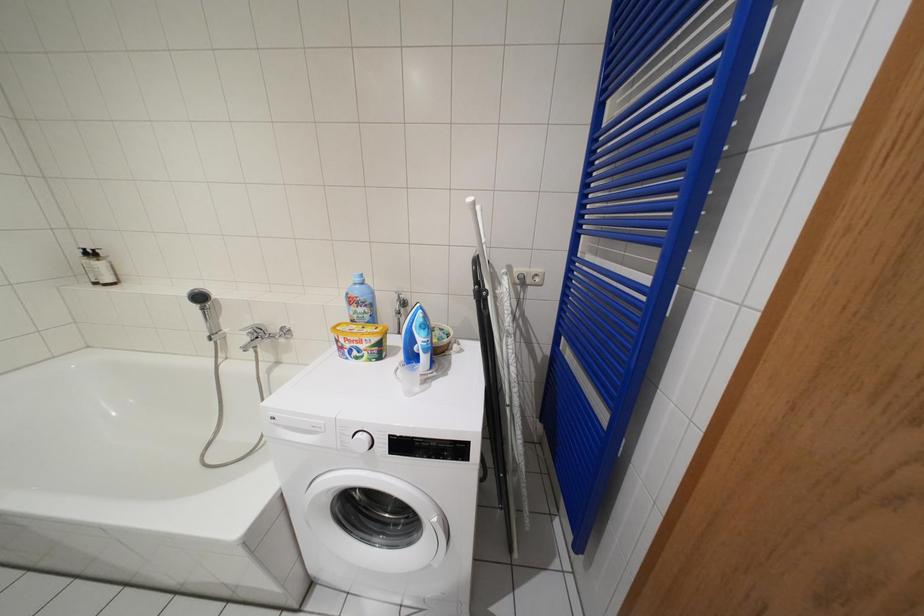
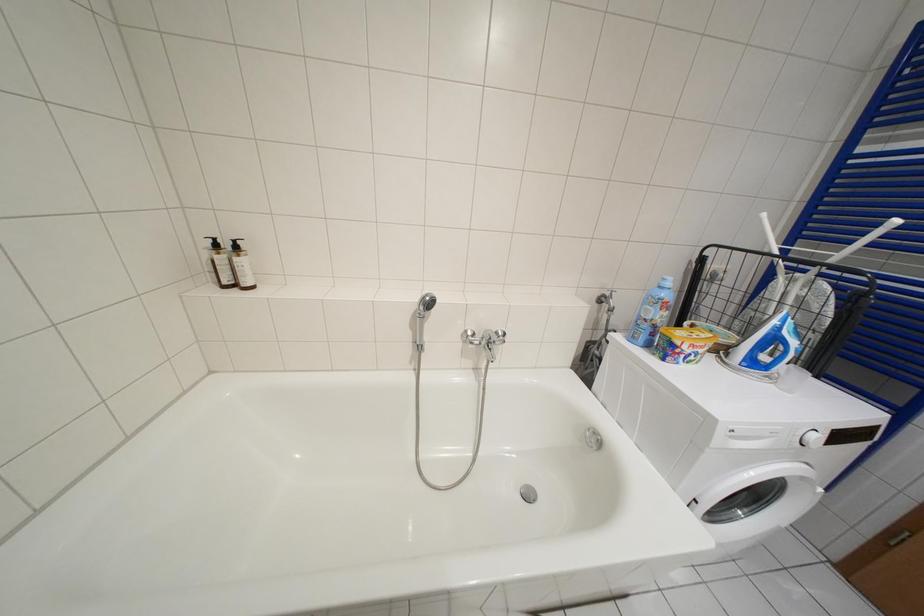
Question: What movement of the cameraman would produce the second image?

Choices:
 (A) Left
 (B) Right
 (C) Forward
 (D) Backward

Answer: (A)